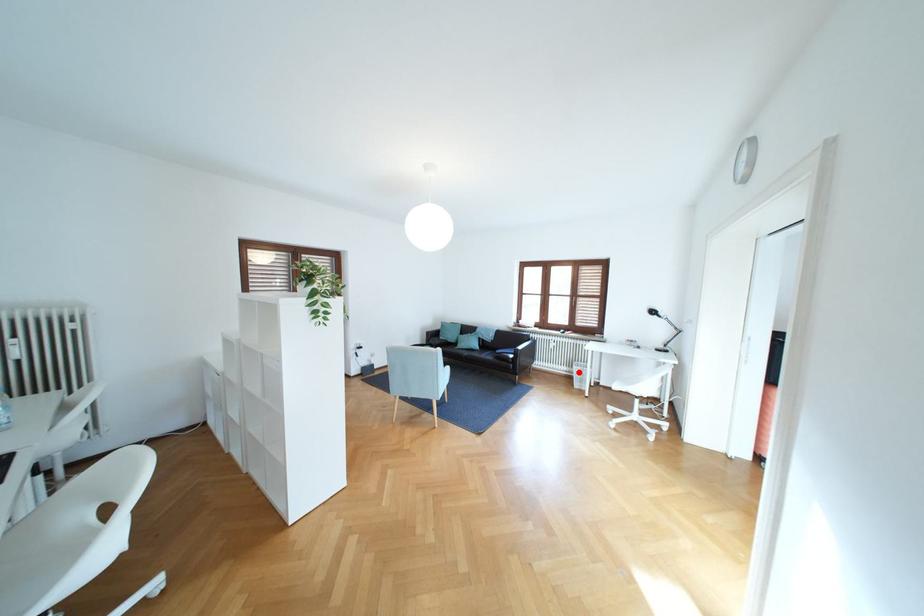
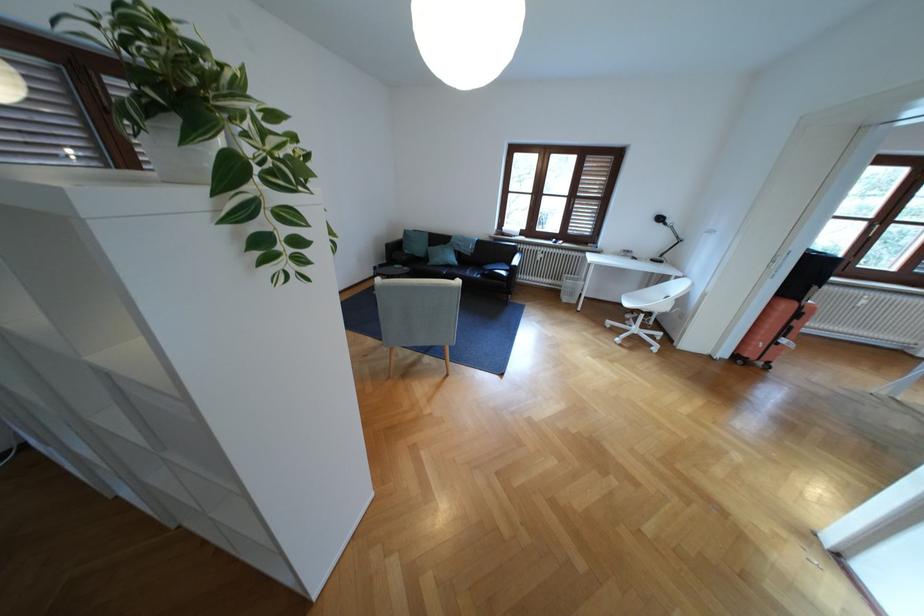
Question: A red point is marked in image1. In image2, is the corresponding 3D point closer to the camera or farther? Reply with the corresponding letter.

Choices:
 (A) The corresponding 3D point is closer.
 (B) The corresponding 3D point is farther.

Answer: (A)